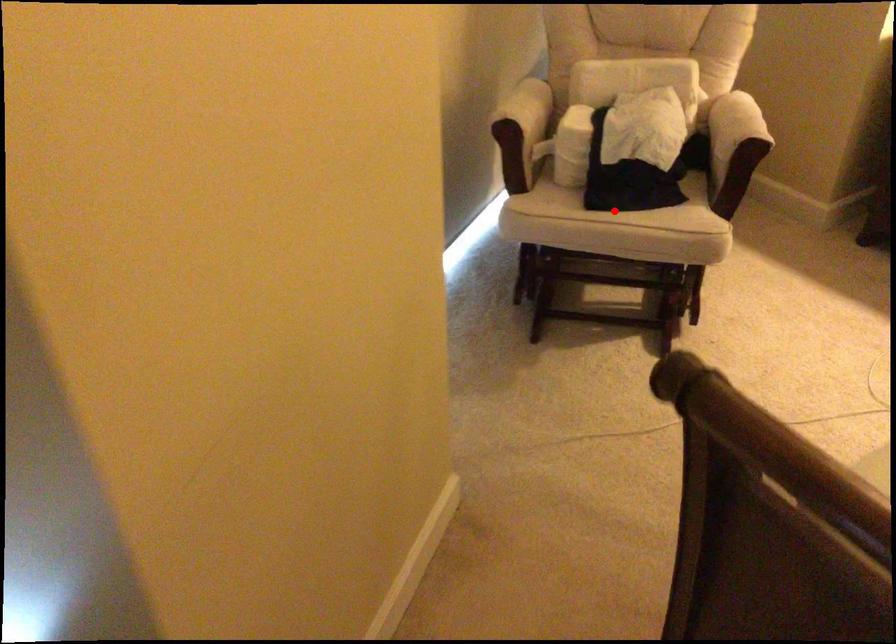
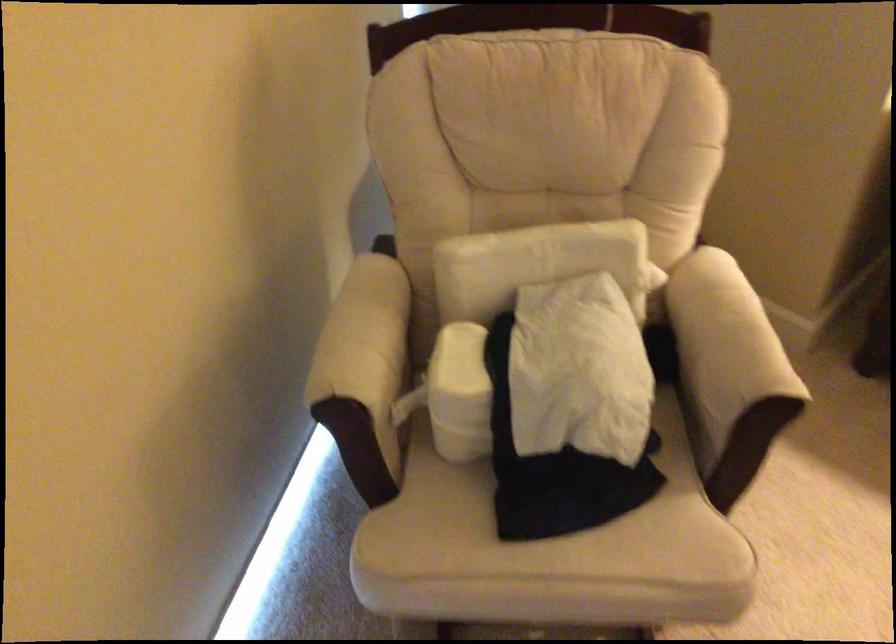
Question: I am providing you with two images of the same scene from different viewpoints. A red point is shown in image1. For the corresponding object point in image2, is it positioned nearer or farther from the camera?

Choices:
 (A) Nearer
 (B) Farther

Answer: (A)